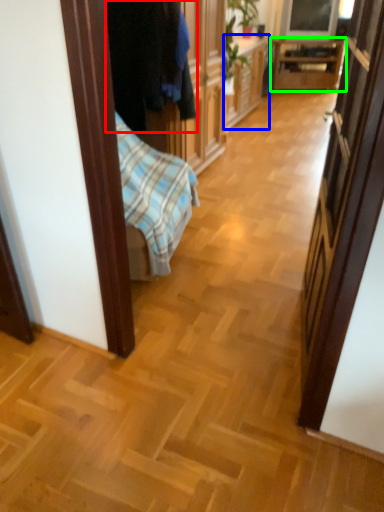
Question: Which is nearer to the clothing (highlighted by a red box)? cabinetry (highlighted by a blue box) or table (highlighted by a green box).

Choices:
 (A) cabinetry
 (B) table

Answer: (A)